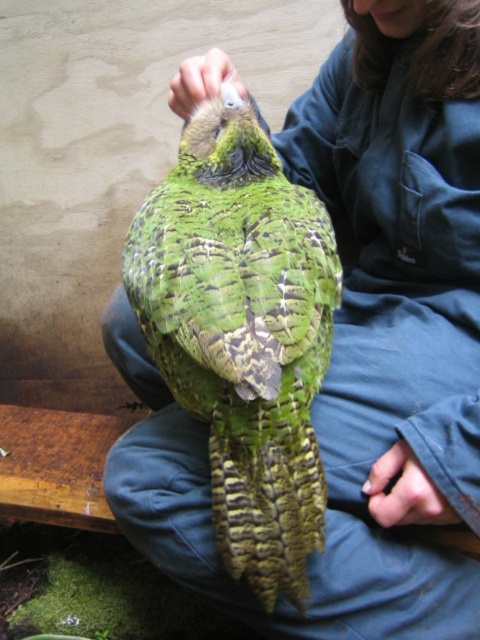
Question: Does green scaly parrot at center have a smaller size compared to white matte hand at upper center?

Choices:
 (A) no
 (B) yes

Answer: (A)

Question: Among these points, which one is farthest from the camera?

Choices:
 (A) (274, 604)
 (B) (423, 468)
 (C) (217, 92)

Answer: (C)

Question: Which of these objects is positioned farthest from the white matte hand at upper center?

Choices:
 (A) smooth skin hand at lower right
 (B) green scaly parrot at center

Answer: (A)

Question: Which point is closer to the camera?

Choices:
 (A) (398, 499)
 (B) (188, 100)
 (C) (224, 211)

Answer: (A)

Question: Does green scaly parrot at center have a smaller size compared to white matte hand at upper center?

Choices:
 (A) no
 (B) yes

Answer: (A)

Question: Can you confirm if green scaly parrot at center is positioned below smooth skin hand at lower right?

Choices:
 (A) yes
 (B) no

Answer: (B)